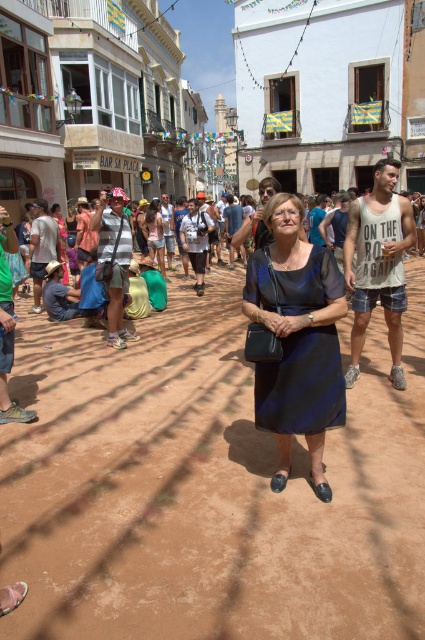
Question: Which object is farther from the camera taking this photo?

Choices:
 (A) navy satin dress at center
 (B) matte black dress at center

Answer: (B)

Question: Among these points, which one is nearest to the camera?

Choices:
 (A) (153, 230)
 (B) (311, 326)

Answer: (B)

Question: Does navy satin dress at center appear on the right side of matte black dress at center?

Choices:
 (A) yes
 (B) no

Answer: (A)

Question: Does navy satin dress at center appear under matte black dress at center?

Choices:
 (A) yes
 (B) no

Answer: (A)

Question: Is navy satin dress at center further to the viewer compared to matte black dress at center?

Choices:
 (A) no
 (B) yes

Answer: (A)